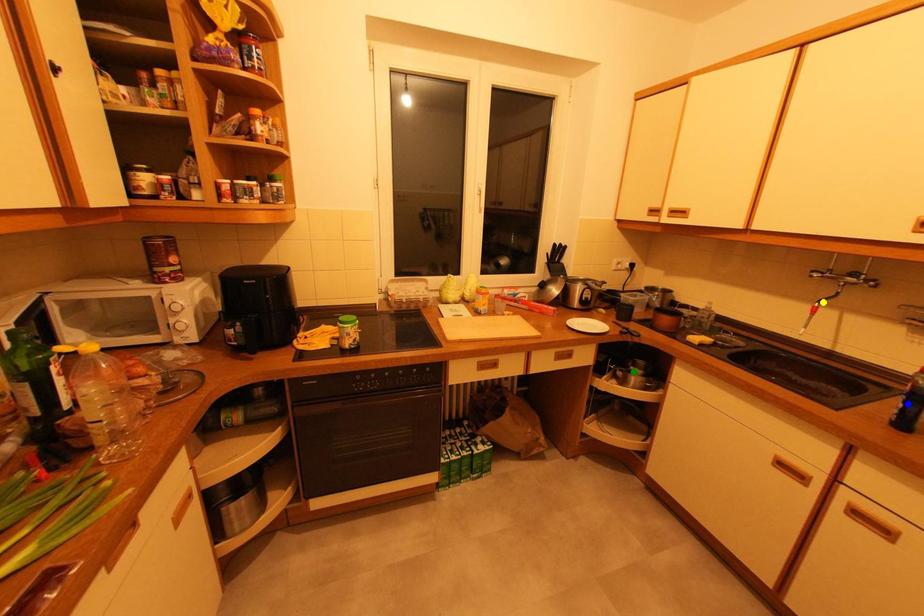
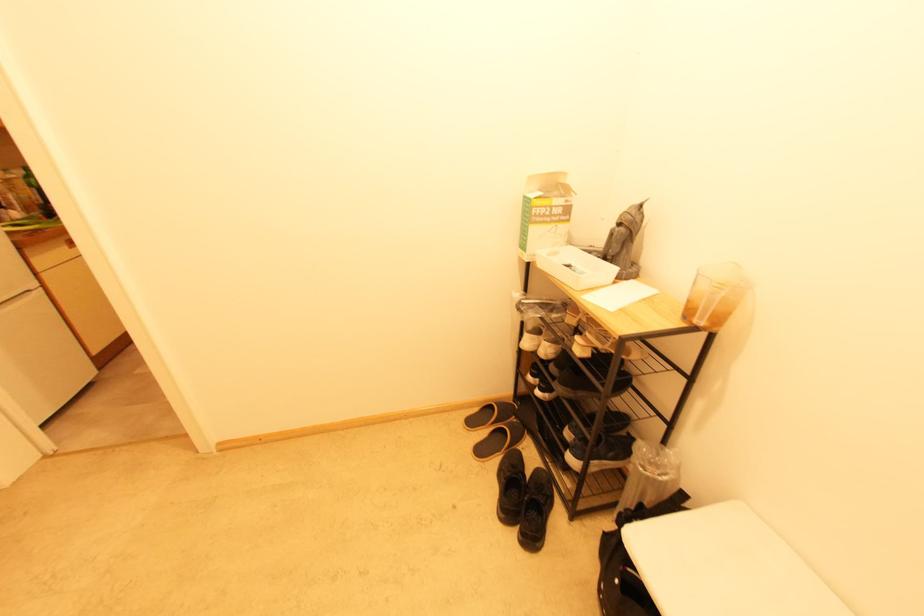
I am providing you with two images of the same scene from different viewpoints. Three points are marked in image1. Which point corresponds to a part or object that is occluded in image2?In image1, three points are marked. Which of them correspond to a part or object that is occluded in image2?Among the three points shown in image1, which one corresponds to a part or object that is no longer visible due to occlusion in image2?

yellow point, blue point, green point